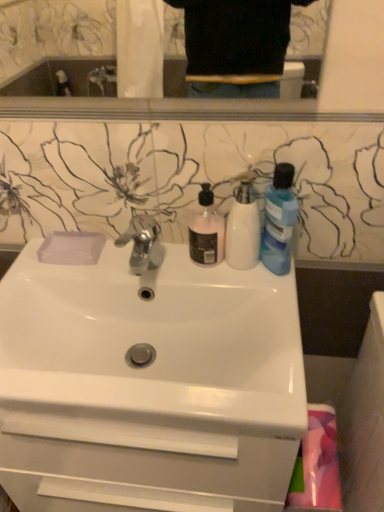
Identify the location of vacant area that is situated to the right of transparent plastic soap at upper left. The width and height of the screenshot is (384, 512). pyautogui.click(x=145, y=263).